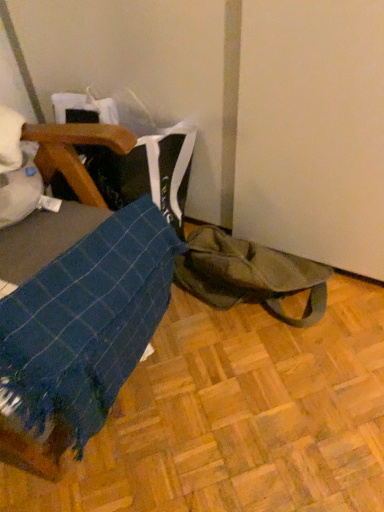
Where is `blue woven fabric at lower left`? The height and width of the screenshot is (512, 384). blue woven fabric at lower left is located at coordinates (64, 204).

What do you see at coordinates (64, 204) in the screenshot?
I see `blue woven fabric at lower left` at bounding box center [64, 204].

What are the coordinates of `olive green canvas tote bag at lower right` in the screenshot? It's located at (249, 275).

Image resolution: width=384 pixels, height=512 pixels. What do you see at coordinates (249, 275) in the screenshot? I see `olive green canvas tote bag at lower right` at bounding box center [249, 275].

The image size is (384, 512). Identify the location of blue woven fabric at lower left. (64, 204).

Considering the positions of objects blue woven fabric at lower left and olive green canvas tote bag at lower right in the image provided, who is more to the right, blue woven fabric at lower left or olive green canvas tote bag at lower right?

olive green canvas tote bag at lower right.

Consider the image. Considering the relative positions of blue woven fabric at lower left and olive green canvas tote bag at lower right in the image provided, is blue woven fabric at lower left in front of olive green canvas tote bag at lower right?

Yes, it is.

Which point is more distant from viewer, (25, 242) or (245, 281)?

The point (245, 281) is farther.

From the image's perspective, is blue woven fabric at lower left above or below olive green canvas tote bag at lower right?

blue woven fabric at lower left is below olive green canvas tote bag at lower right.

From a real-world perspective, is blue woven fabric at lower left on olive green canvas tote bag at lower right?

Yes.

Can you confirm if blue woven fabric at lower left is wider than olive green canvas tote bag at lower right?

Incorrect, the width of blue woven fabric at lower left does not surpass that of olive green canvas tote bag at lower right.

Does blue woven fabric at lower left have a lesser height compared to olive green canvas tote bag at lower right?

Incorrect, the height of blue woven fabric at lower left does not fall short of that of olive green canvas tote bag at lower right.

Looking at the image, does blue woven fabric at lower left seem bigger or smaller compared to olive green canvas tote bag at lower right?

blue woven fabric at lower left is bigger than olive green canvas tote bag at lower right.

Is blue woven fabric at lower left spatially inside olive green canvas tote bag at lower right, or outside of it?

blue woven fabric at lower left is located beyond the bounds of olive green canvas tote bag at lower right.

Are blue woven fabric at lower left and olive green canvas tote bag at lower right beside each other?

No, blue woven fabric at lower left is not in contact with olive green canvas tote bag at lower right.

Is blue woven fabric at lower left oriented away from olive green canvas tote bag at lower right?

No.

Can you tell me how much blue woven fabric at lower left and olive green canvas tote bag at lower right differ in facing direction?

blue woven fabric at lower left and olive green canvas tote bag at lower right are facing 9.93 degrees away from each other.

The width and height of the screenshot is (384, 512). I want to click on furniture that appears on the left of olive green canvas tote bag at lower right, so click(x=64, y=204).

Based on their positions, is olive green canvas tote bag at lower right located to the left or right of blue woven fabric at lower left?

From the image, it's evident that olive green canvas tote bag at lower right is to the right of blue woven fabric at lower left.

Considering the relative positions of olive green canvas tote bag at lower right and blue woven fabric at lower left in the image provided, is olive green canvas tote bag at lower right in front of blue woven fabric at lower left?

No, it is not.

Which point is more distant from viewer, (x=291, y=255) or (x=41, y=245)?

Positioned behind is point (x=291, y=255).

From the image's perspective, is olive green canvas tote bag at lower right below blue woven fabric at lower left?

No, from the image's perspective, olive green canvas tote bag at lower right is not beneath blue woven fabric at lower left.

From a real-world perspective, between olive green canvas tote bag at lower right and blue woven fabric at lower left, who is vertically higher?

blue woven fabric at lower left.

Looking at this image, which of these two, olive green canvas tote bag at lower right or blue woven fabric at lower left, is thinner?

With smaller width is blue woven fabric at lower left.

Between olive green canvas tote bag at lower right and blue woven fabric at lower left, which one has less height?

With less height is olive green canvas tote bag at lower right.

Considering the relative sizes of olive green canvas tote bag at lower right and blue woven fabric at lower left in the image provided, is olive green canvas tote bag at lower right bigger than blue woven fabric at lower left?

No, olive green canvas tote bag at lower right is not bigger than blue woven fabric at lower left.

Can blue woven fabric at lower left be found inside olive green canvas tote bag at lower right?

No, olive green canvas tote bag at lower right does not contain blue woven fabric at lower left.

In the scene shown: Are olive green canvas tote bag at lower right and blue woven fabric at lower left far apart?

olive green canvas tote bag at lower right is near blue woven fabric at lower left, not far away.

Is olive green canvas tote bag at lower right looking in the opposite direction of blue woven fabric at lower left?

olive green canvas tote bag at lower right is not turned away from blue woven fabric at lower left.

How different are the orientations of olive green canvas tote bag at lower right and blue woven fabric at lower left in degrees?

olive green canvas tote bag at lower right and blue woven fabric at lower left are facing 9.93 degrees away from each other.

Locate an element on the screen. tote bag lying behind the blue woven fabric at lower left is located at coordinates (249, 275).

The height and width of the screenshot is (512, 384). Identify the location of tote bag that is on the right side of blue woven fabric at lower left. (249, 275).

The width and height of the screenshot is (384, 512). I want to click on tote bag lying behind the blue woven fabric at lower left, so click(249, 275).